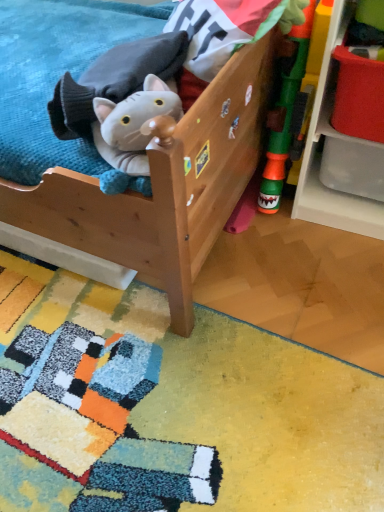
This screenshot has height=512, width=384. In order to click on vacant space in front of rubberized green toy at right, the first toy in the right-to-left sequence in this screenshot , I will do `click(291, 247)`.